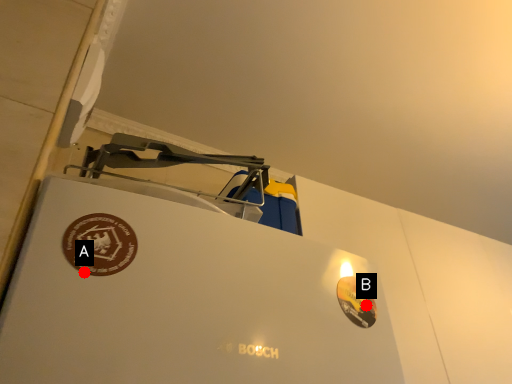
Question: Two points are circled on the image, labeled by A and B beside each circle. Among these points, which one is farthest from the camera?

Choices:
 (A) A is further
 (B) B is further

Answer: (B)